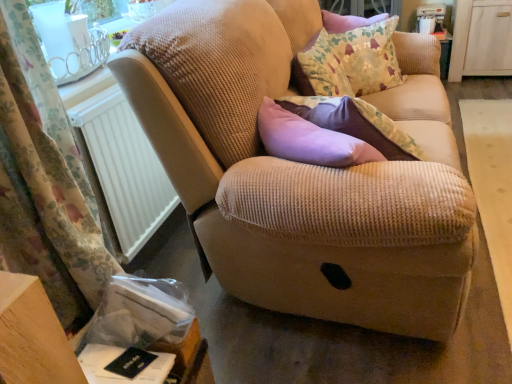
Question: In terms of width, does floral fabric cushion at upper right look wider or thinner when compared to white plastic radiator at left?

Choices:
 (A) wide
 (B) thin

Answer: (A)

Question: Relative to white plastic radiator at left, is floral fabric cushion at upper right in front or behind?

Choices:
 (A) front
 (B) behind

Answer: (B)

Question: Considering the real-world distances, which object is closest to the white wood dresser at upper right?

Choices:
 (A) beige corduroy couch at center
 (B) floral fabric curtain at left
 (C) floral fabric cushion at upper right
 (D) white plastic radiator at left

Answer: (C)

Question: Which of these objects is positioned closest to the white wood dresser at upper right?

Choices:
 (A) white plastic radiator at left
 (B) floral fabric cushion at upper right
 (C) beige corduroy couch at center
 (D) floral fabric curtain at left

Answer: (B)